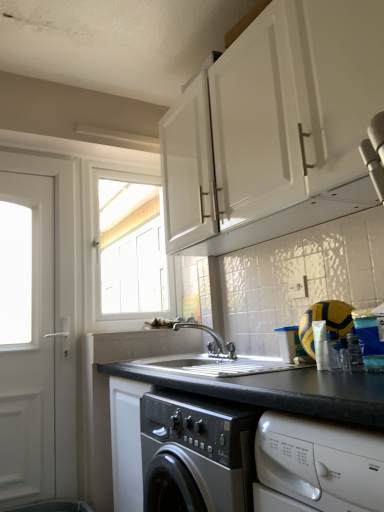
Question: Considering the relative sizes of silver metallic faucet at center and white glossy window at upper center in the image provided, is silver metallic faucet at center thinner than white glossy window at upper center?

Choices:
 (A) yes
 (B) no

Answer: (B)

Question: From a real-world perspective, is silver metallic faucet at center beneath white glossy window at upper center?

Choices:
 (A) no
 (B) yes

Answer: (B)

Question: Is silver metallic faucet at center positioned with its back to white glossy window at upper center?

Choices:
 (A) yes
 (B) no

Answer: (B)

Question: Is white glossy window at upper center a part of silver metallic faucet at center?

Choices:
 (A) yes
 (B) no

Answer: (B)

Question: Is silver metallic faucet at center taller than white glossy window at upper center?

Choices:
 (A) yes
 (B) no

Answer: (B)

Question: Considering the relative positions of silver metallic faucet at center and white glossy window at upper center in the image provided, is silver metallic faucet at center behind white glossy window at upper center?

Choices:
 (A) no
 (B) yes

Answer: (A)

Question: Is silver metallic faucet at center thinner than white matte cabinet at upper center?

Choices:
 (A) yes
 (B) no

Answer: (A)

Question: From a real-world perspective, does silver metallic faucet at center sit lower than white matte cabinet at upper center?

Choices:
 (A) yes
 (B) no

Answer: (A)

Question: Is silver metallic faucet at center closer to the viewer compared to white matte cabinet at upper center?

Choices:
 (A) no
 (B) yes

Answer: (A)

Question: Could white matte cabinet at upper center be considered to be inside silver metallic faucet at center?

Choices:
 (A) yes
 (B) no

Answer: (B)

Question: Is silver metallic faucet at center shorter than white matte cabinet at upper center?

Choices:
 (A) no
 (B) yes

Answer: (B)

Question: Considering the relative sizes of silver metallic faucet at center and white matte cabinet at upper center in the image provided, is silver metallic faucet at center bigger than white matte cabinet at upper center?

Choices:
 (A) no
 (B) yes

Answer: (A)

Question: Is white matte door at left closer to camera compared to black granite countertop at center?

Choices:
 (A) yes
 (B) no

Answer: (B)